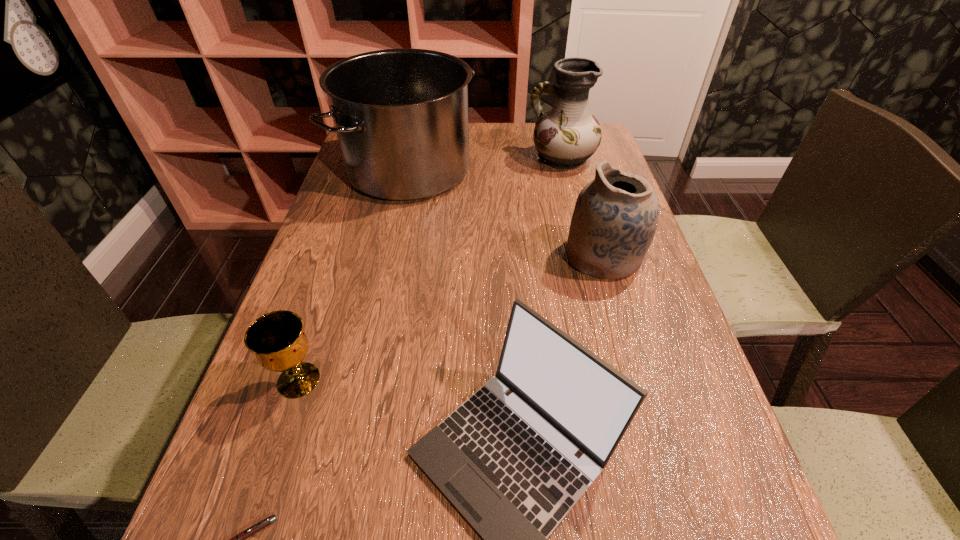
Identify the location of vase. (566, 136).

Where is `saucepan`? Image resolution: width=960 pixels, height=540 pixels. saucepan is located at coordinates (401, 118).

Where is `pottery`? pottery is located at coordinates (615, 217).

I want to click on the fourth shortest object, so click(x=615, y=217).

Find the location of a particular element. The image size is (960, 540). chalice is located at coordinates (277, 338).

The width and height of the screenshot is (960, 540). What are the coordinates of `vacant space situated on the left of the vase` in the screenshot? It's located at (479, 159).

This screenshot has width=960, height=540. Identify the location of vacant region located 0.160m on the right of the saucepan. (533, 170).

Locate an element on the screen. The height and width of the screenshot is (540, 960). free space located 0.060m on the front of the pottery is located at coordinates (618, 306).

This screenshot has height=540, width=960. What are the coordinates of `free spot located on the back of the second shortest object` in the screenshot? It's located at (342, 250).

Locate an element on the screen. The image size is (960, 540). vase located at the far edge is located at coordinates (566, 136).